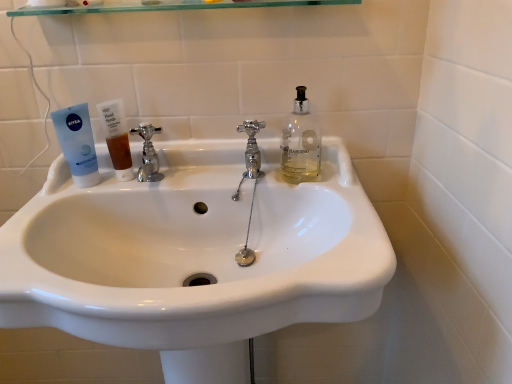
Find the location of a particular element. The width and height of the screenshot is (512, 384). vacant area on top of transparent glass shelf at upper center (from a real-world perspective) is located at coordinates (196, 9).